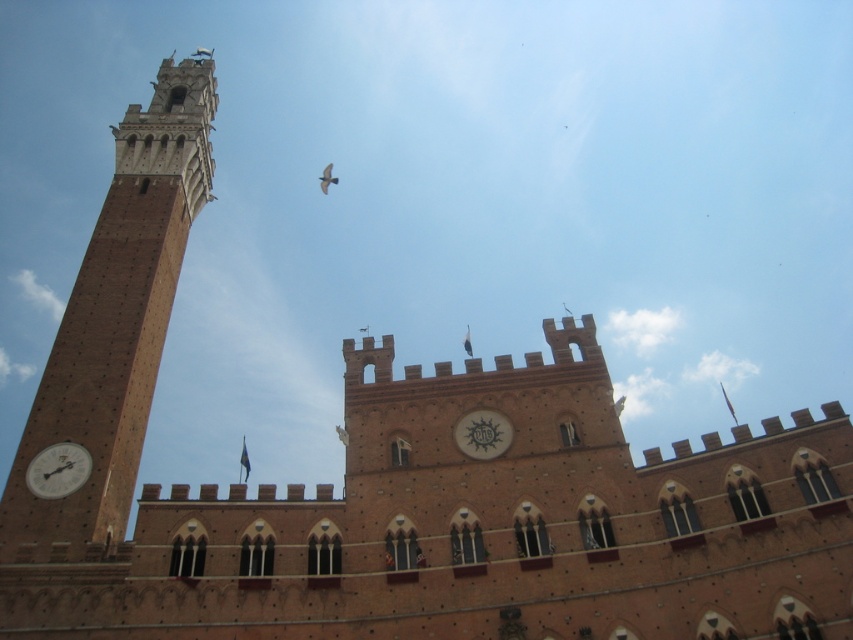
Question: Which of the following is the closest to the observer?

Choices:
 (A) matte brown clock at left
 (B) white glossy clock at center
 (C) brown brick bell tower at left

Answer: (C)

Question: Considering the relative positions of brown brick bell tower at left and white glossy clock at center in the image provided, where is brown brick bell tower at left located with respect to white glossy clock at center?

Choices:
 (A) right
 (B) left

Answer: (B)

Question: Does brown brick bell tower at left have a lesser width compared to white glossy clock at center?

Choices:
 (A) yes
 (B) no

Answer: (B)

Question: Which point is closer to the camera?

Choices:
 (A) white glossy clock at center
 (B) brown brick bell tower at left

Answer: (B)

Question: Estimate the real-world distances between objects in this image. Which object is closer to the white glossy clock at center?

Choices:
 (A) matte brown clock at left
 (B) brown brick bell tower at left

Answer: (A)

Question: In this image, where is brown brick bell tower at left located relative to white glossy clock at center?

Choices:
 (A) left
 (B) right

Answer: (A)